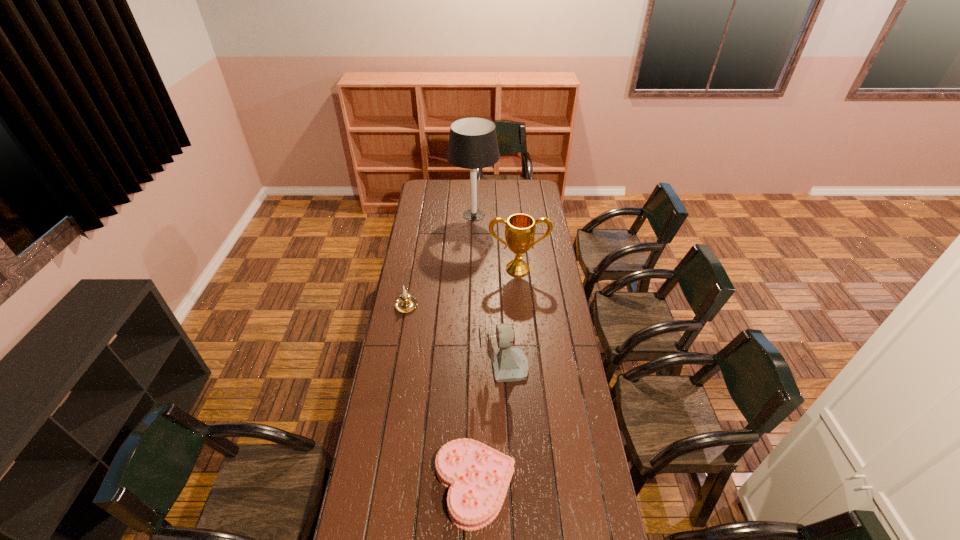
The image size is (960, 540). I want to click on the second closest object to the table lamp, so click(406, 302).